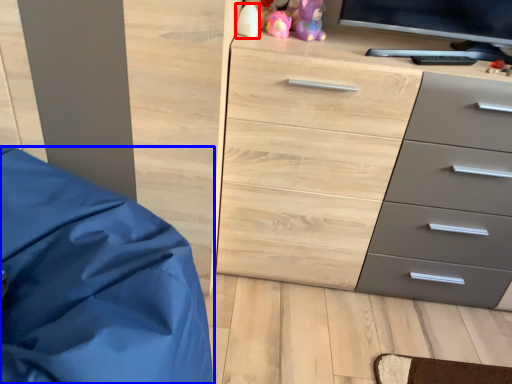
Question: Which object is closer to the camera taking this photo, toy (highlighted by a red box) or furniture (highlighted by a blue box)?

Choices:
 (A) toy
 (B) furniture

Answer: (B)